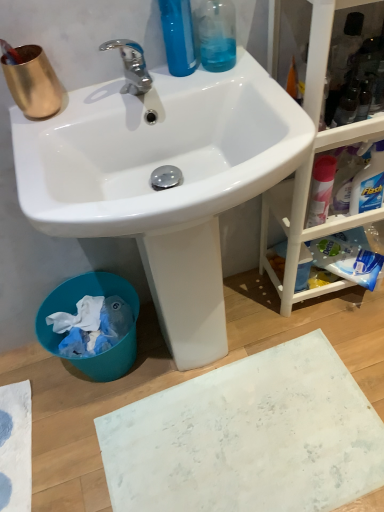
Find the location of `vacant space that is in between transparent plastic bottle at upper center and chrome metallic faucet at upper center`. vacant space that is in between transparent plastic bottle at upper center and chrome metallic faucet at upper center is located at coordinates (185, 82).